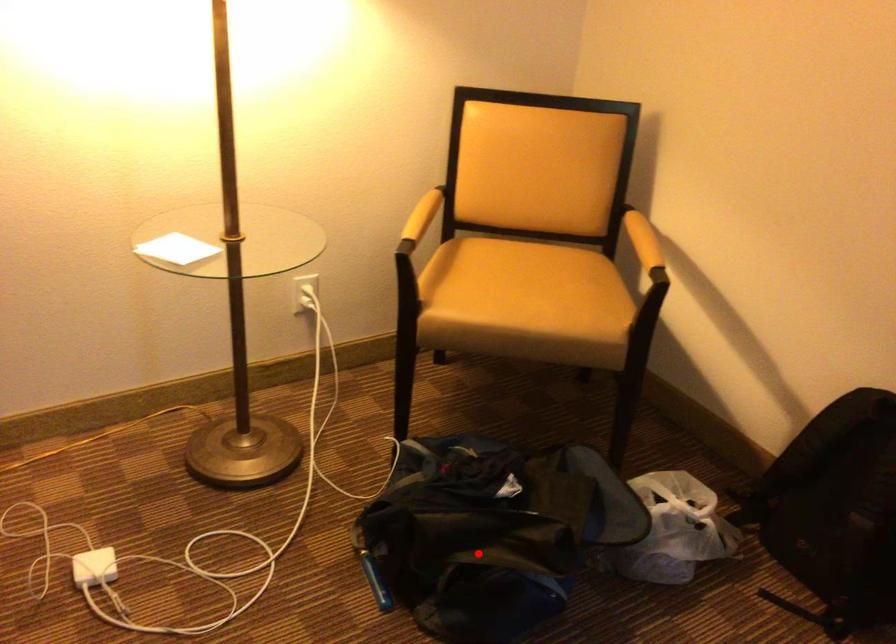
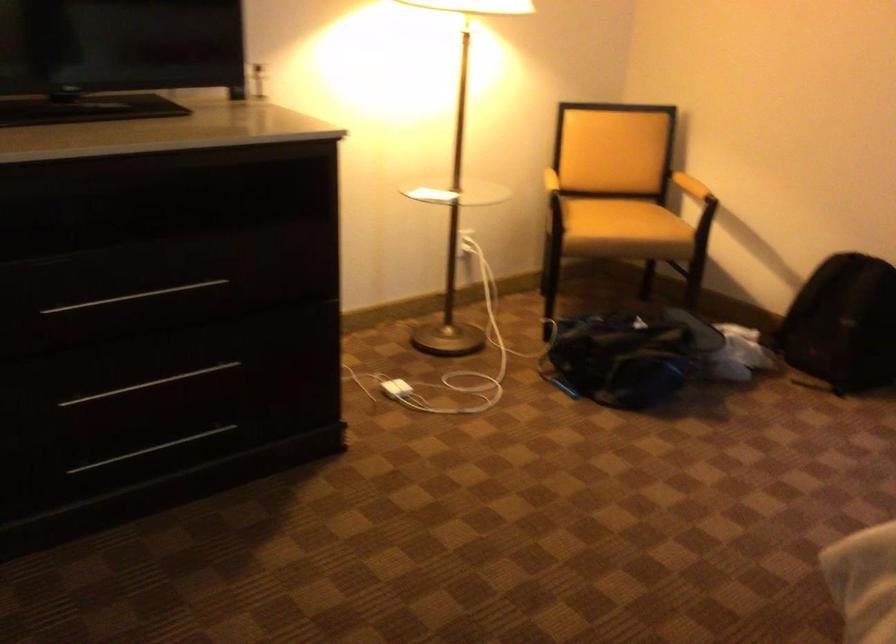
Locate, in the second image, the point that corresponds to the highlighted location in the first image.

(627, 355)